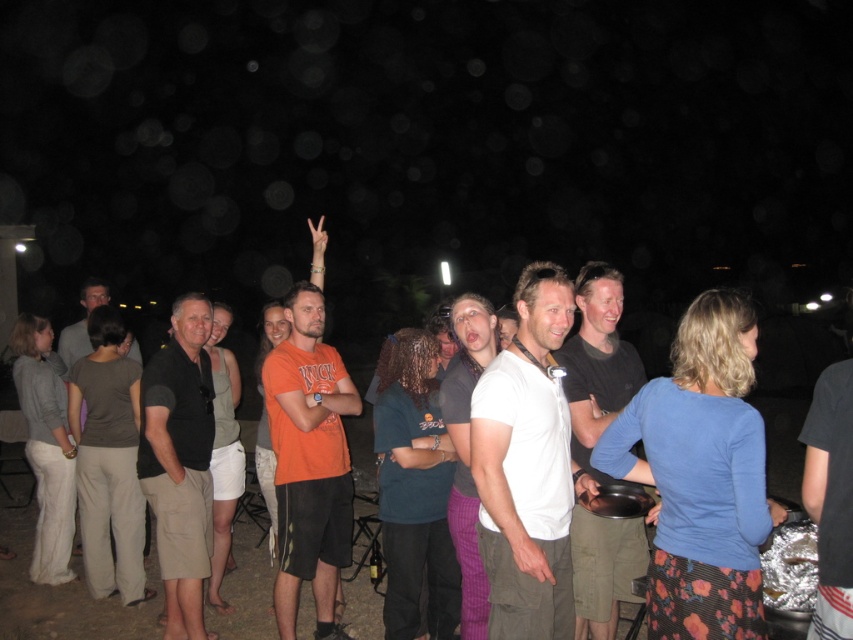
You are standing at the origin point in the image. Which direction should you move to reach the black cotton shirt at center?

The black cotton shirt at center is located at point 0.719 on the x axis and 0.211 on the y axis. Since you are at the origin point, you should move to the right along the x axis and slightly upwards along the y axis to reach it.

You are a photographer at this nighttime gathering and want to take a group photo of the black cotton shirt at center and the dark gray shirt at left. The camera you have can only focus on objects within a 1.5 meter range. Will both shirts be in focus?

The black cotton shirt at center is 1.80 meters from the dark gray shirt at left, which is beyond the camera focus range of 1.5 meters. Therefore, both shirts cannot be in focus simultaneously.